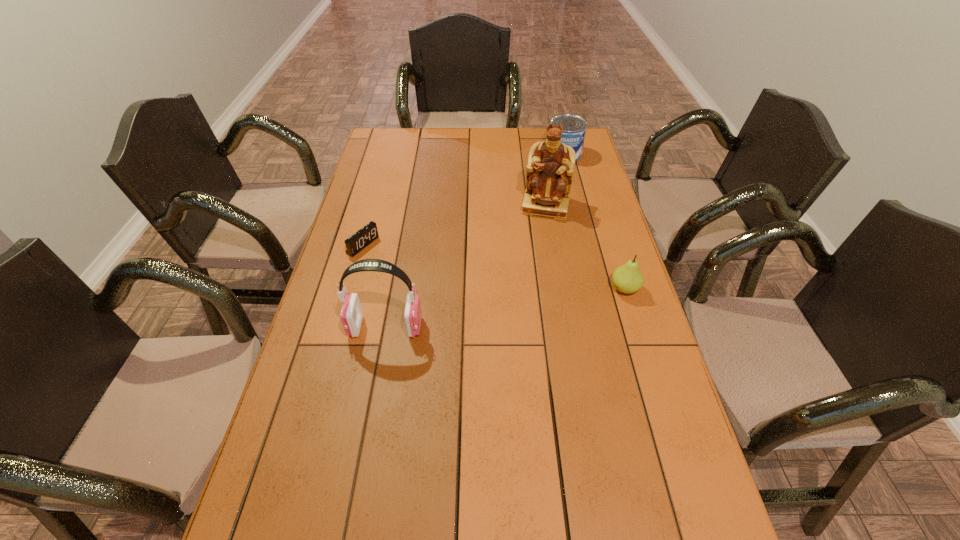
Locate an element on the screen. The height and width of the screenshot is (540, 960). free point located on the front label of the can is located at coordinates (537, 212).

Where is `object at the far edge`? The width and height of the screenshot is (960, 540). object at the far edge is located at coordinates (574, 127).

At what (x,y) coordinates should I click in order to perform the action: click on earphone that is positioned at the left edge. Please return your answer as a coordinate pair (x, y). This screenshot has height=540, width=960. Looking at the image, I should click on (351, 315).

Find the location of a particular element. alarm clock that is at the left edge is located at coordinates (362, 238).

Identify the location of pear present at the right edge. (627, 278).

This screenshot has height=540, width=960. In order to click on figurine that is at the right edge in this screenshot , I will do `click(550, 166)`.

I want to click on can at the right edge, so click(574, 127).

This screenshot has height=540, width=960. What are the coordinates of `object that is at the far right corner` in the screenshot? It's located at (574, 127).

In the image, there is a desktop. At what (x,y) coordinates should I click in order to perform the action: click on vacant space at the far edge. Please return your answer as a coordinate pair (x, y). Looking at the image, I should click on (458, 129).

Find the location of a particular element. The width and height of the screenshot is (960, 540). blank space at the left edge of the desktop is located at coordinates click(365, 278).